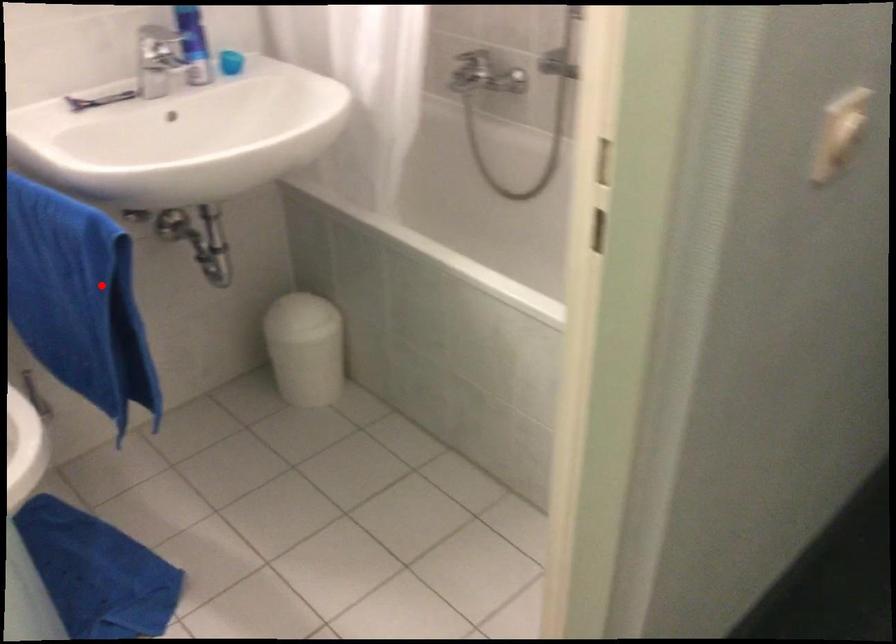
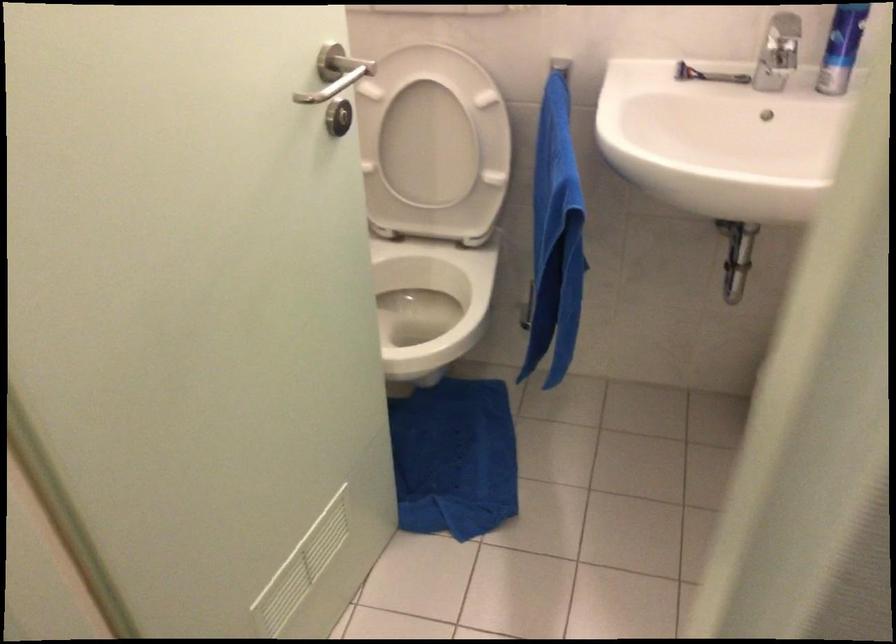
Find the pixel in the second image that matches the highlighted location in the first image.

(555, 238)